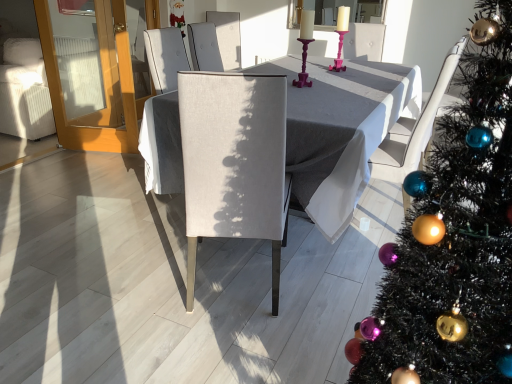
Question: From the image's perspective, relative to pink plastic candle holder at center, is matte gray table at center above or below?

Choices:
 (A) below
 (B) above

Answer: (A)

Question: In the image, is matte gray table at center positioned in front of or behind pink plastic candle holder at center?

Choices:
 (A) front
 (B) behind

Answer: (A)

Question: Which object is the farthest from the shiny green christmas tree at right?

Choices:
 (A) transparent glass door at left
 (B) pink plastic candle holder at center
 (C) matte gray table at center
 (D) white fabric armchair at right
 (E) matte gray chair at center

Answer: (A)

Question: Which of these objects is positioned closest to the white fabric armchair at right?

Choices:
 (A) shiny green christmas tree at right
 (B) matte gray chair at center
 (C) pink plastic candle holder at center
 (D) matte gray table at center
 (E) matte glass candlesticks at upper center

Answer: (D)